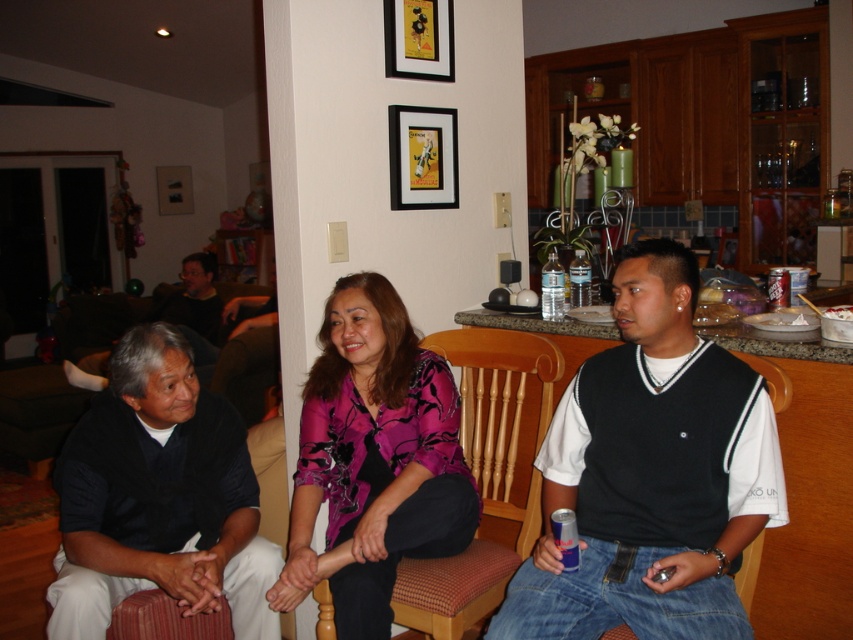
You are a photographer standing at the center of the room. You need to take a photo that includes both the black matte shirt at lower left and the gold metallic picture frame at upper center. Considering their distance apart, will you be able to fit both into your camera view without moving closer or farther away?

The black matte shirt at lower left is 1.42 meters away from the gold metallic picture frame at upper center. Since the distance between them is 1.42 meters, it depends on your camera lens and field of view. However, given typical camera settings, it might be challenging to capture both in a single frame without adjusting your position or zoom level.

Looking at this image, you are trying to decide whether the black knit vest at center can fit into a storage box that is the same size as the gold metallic picture frame at upper center. Based on their sizes, will the vest fit?

The black knit vest at center is wider than the gold metallic picture frame at upper center, so it will not fit into a storage box of the same size as the frame.